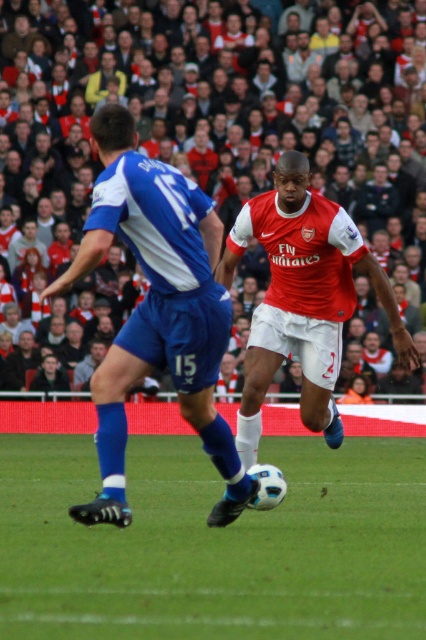
Question: Can you confirm if red fabric crowd at upper center is positioned to the left of blue fabric shorts at left?

Choices:
 (A) no
 (B) yes

Answer: (A)

Question: Which point appears closest to the camera in this image?

Choices:
 (A) (195, 112)
 (B) (299, 573)
 (C) (106, 401)

Answer: (B)

Question: Is green grass at center positioned before red fabric crowd at upper center?

Choices:
 (A) yes
 (B) no

Answer: (A)

Question: Can you confirm if red fabric crowd at upper center is positioned below blue fabric shorts at left?

Choices:
 (A) no
 (B) yes

Answer: (A)

Question: Which point appears farthest from the camera in this image?

Choices:
 (A) (391, 67)
 (B) (339, 605)
 (C) (219, 228)

Answer: (A)

Question: Which object is closer to the camera taking this photo?

Choices:
 (A) blue fabric shorts at left
 (B) green grass at center
 (C) red fabric crowd at upper center

Answer: (B)